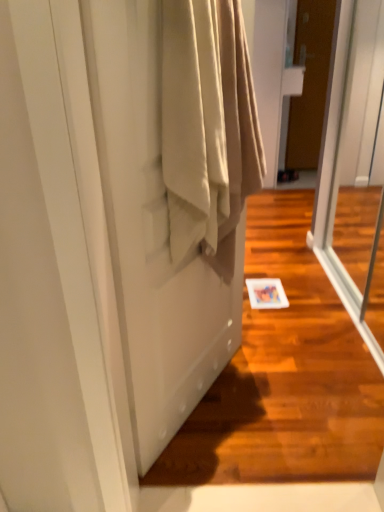
Question: Relative to beige fabric at center, is transparent glass screen door at right, arranged as the 2th screen door when viewed from the left, in front or behind?

Choices:
 (A) behind
 (B) front

Answer: (A)

Question: From the image's perspective, relative to beige fabric at center, is transparent glass screen door at right, arranged as the 2th screen door when viewed from the left, above or below?

Choices:
 (A) below
 (B) above

Answer: (B)

Question: Considering the real-world distances, which object is closest to the satin beige curtain at lower left, the 1th screen door from the left?

Choices:
 (A) brown matte door at upper right
 (B) transparent glass screen door at right, arranged as the 2th screen door when viewed from the left
 (C) beige fabric at center

Answer: (C)

Question: Which object is the farthest from the brown matte door at upper right?

Choices:
 (A) transparent glass screen door at right, which is counted as the first screen door, starting from the right
 (B) satin beige curtain at lower left, the 1th screen door from the left
 (C) beige fabric at center

Answer: (C)